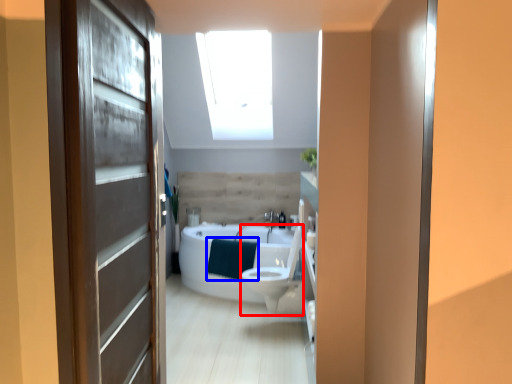
Question: Among these objects, which one is nearest to the camera, toilet bowl (highlighted by a red box) or blanket (highlighted by a blue box)?

Choices:
 (A) toilet bowl
 (B) blanket

Answer: (A)